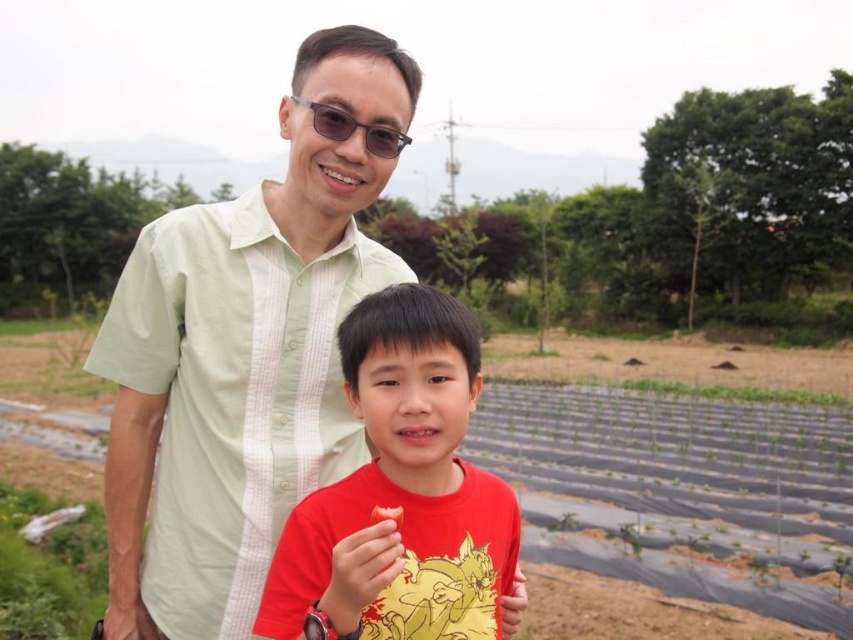
Who is more distant from viewer, (218,252) or (374,140)?

The point (218,252) is behind.

From the picture: Does light green striped shirt at center lie in front of matte black sunglasses at upper center?

That is False.

Is point (149, 294) positioned after point (312, 104)?

Yes.

Where is `light green striped shirt at center`? This screenshot has height=640, width=853. light green striped shirt at center is located at coordinates (231, 384).

Between light green striped shirt at center and red matte shirt at center, which one is positioned higher?

light green striped shirt at center is higher up.

Can you confirm if light green striped shirt at center is bigger than red matte shirt at center?

Yes.

Does point (254, 374) come behind point (439, 502)?

Yes, point (254, 374) is farther from viewer.

The image size is (853, 640). Identify the location of light green striped shirt at center. (231, 384).

Looking at this image, which is more to the right, red matte shirt at center or matte black sunglasses at upper center?

red matte shirt at center is more to the right.

Who is positioned more to the left, red matte shirt at center or matte black sunglasses at upper center?

From the viewer's perspective, matte black sunglasses at upper center appears more on the left side.

Who is more distant from viewer, (404, 573) or (352, 131)?

The point (352, 131) is more distant.

The image size is (853, 640). Identify the location of red matte shirt at center. (401, 490).